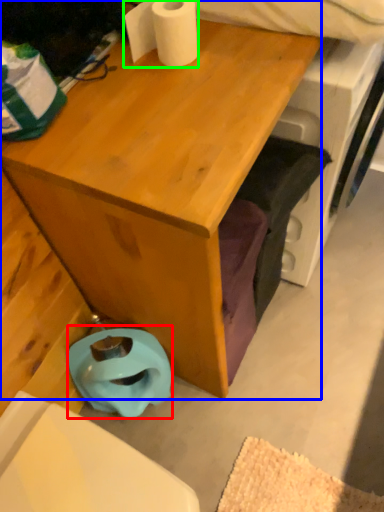
Question: Estimate the real-world distances between objects in this image. Which object is closer to toilet bowl (highlighted by a red box), desk (highlighted by a blue box) or toilet paper (highlighted by a green box)?

Choices:
 (A) desk
 (B) toilet paper

Answer: (A)